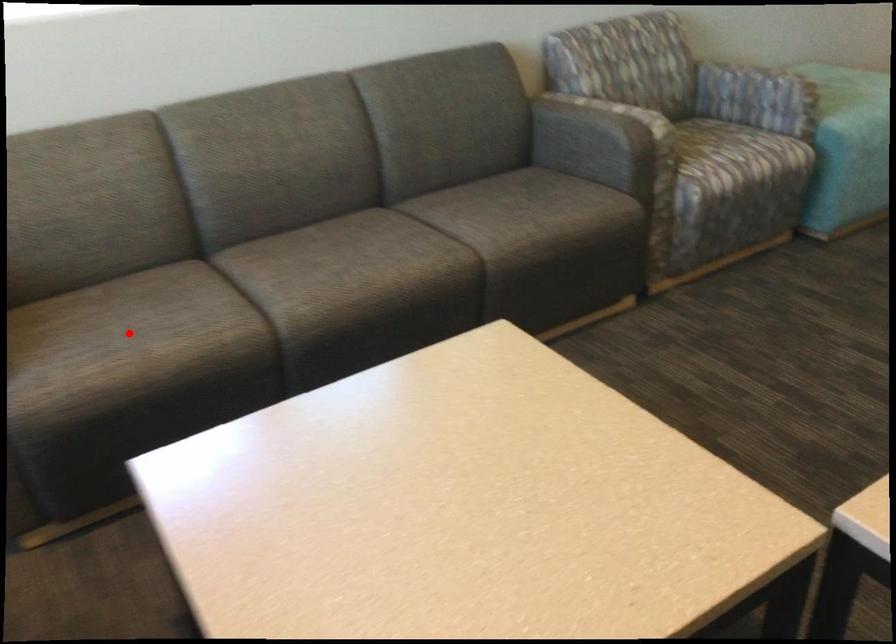
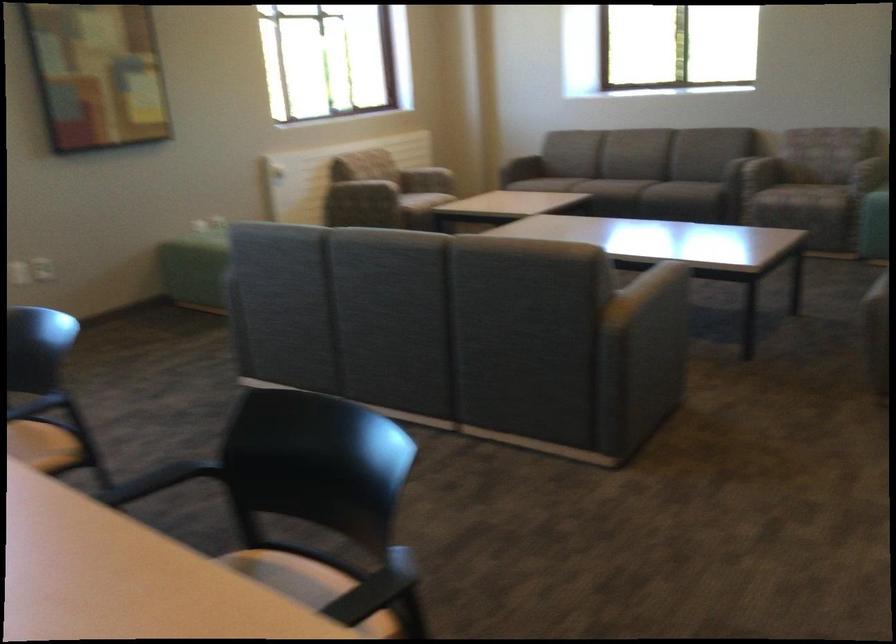
Find the pixel in the second image that matches the highlighted location in the first image.

(522, 167)